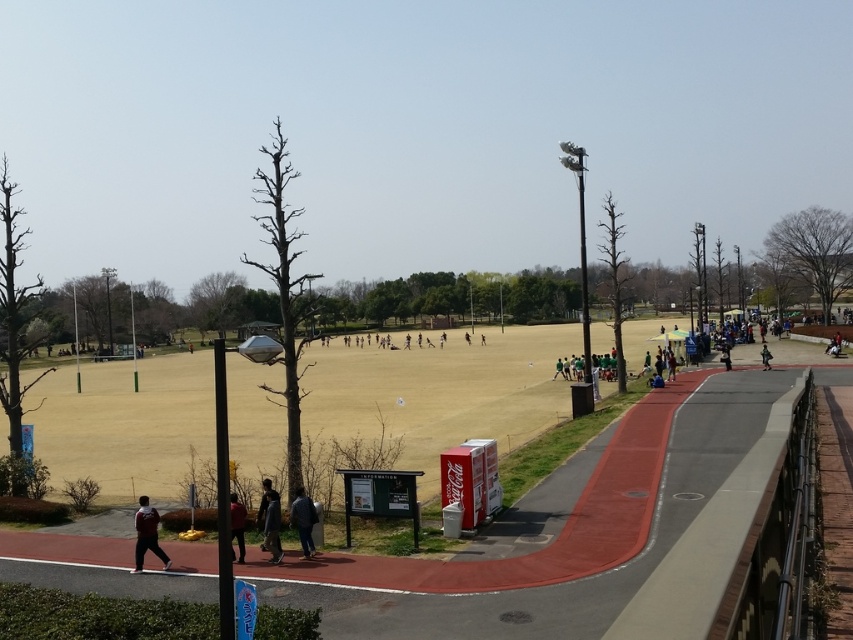
Does dark blue fabric jacket at lower center lie behind dark red fabric jacket at lower left?

That is True.

Is dark blue fabric jacket at lower center shorter than dark red fabric jacket at lower left?

Yes.

Is point (311, 550) positioned behind point (239, 557)?

Yes, it is behind point (239, 557).

Identify the location of dark blue fabric jacket at lower center. The image size is (853, 640). (303, 520).

Which of these two, grass soccer field at center or dark gray fabric jacket at lower center, stands shorter?

dark gray fabric jacket at lower center

Which is in front, point (537, 332) or point (263, 509)?

Point (263, 509) is in front.

Find the location of a particular element. This screenshot has width=853, height=640. grass soccer field at center is located at coordinates (440, 392).

Is dark red jacket at lower left closer to the viewer compared to dark blue fabric jacket at lower center?

Yes, dark red jacket at lower left is closer to the viewer.

The image size is (853, 640). What are the coordinates of `dark red jacket at lower left` in the screenshot? It's located at [146, 534].